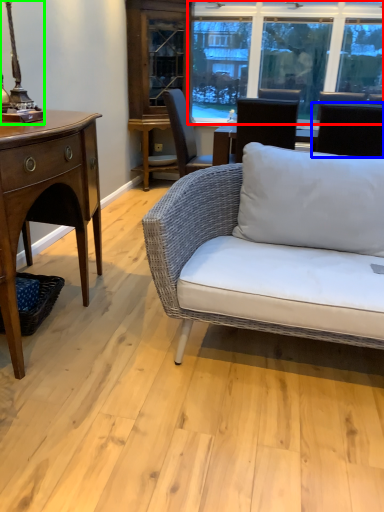
Question: Which is nearer to the window (highlighted by a red box)? chair (highlighted by a blue box) or table lamp (highlighted by a green box).

Choices:
 (A) chair
 (B) table lamp

Answer: (A)